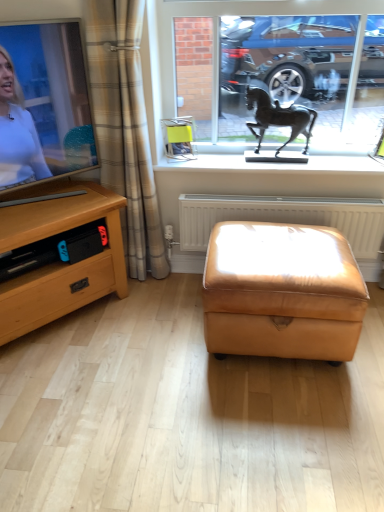
The width and height of the screenshot is (384, 512). In order to click on vacant space that's between wooden desk at left and beige plaid curtain at left in this screenshot , I will do `click(135, 301)`.